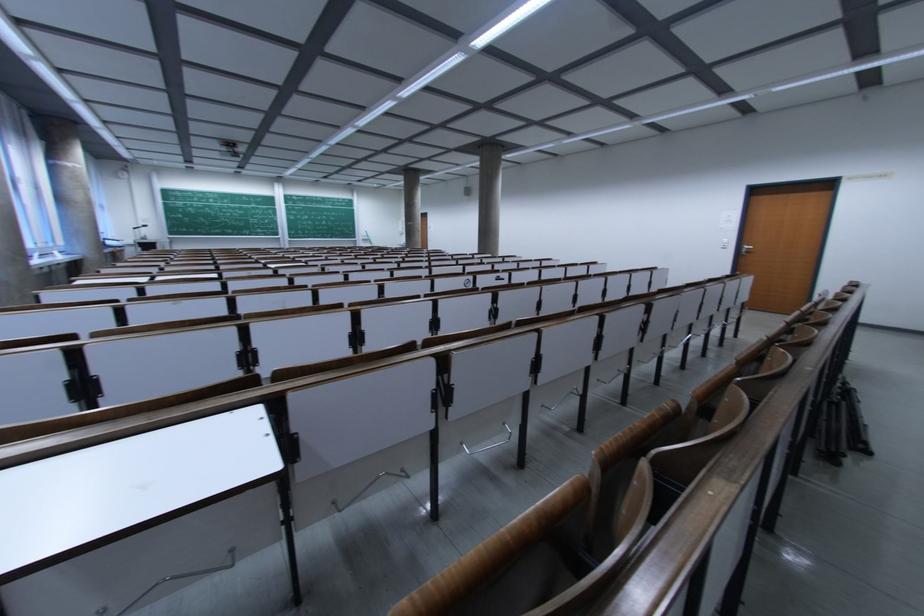
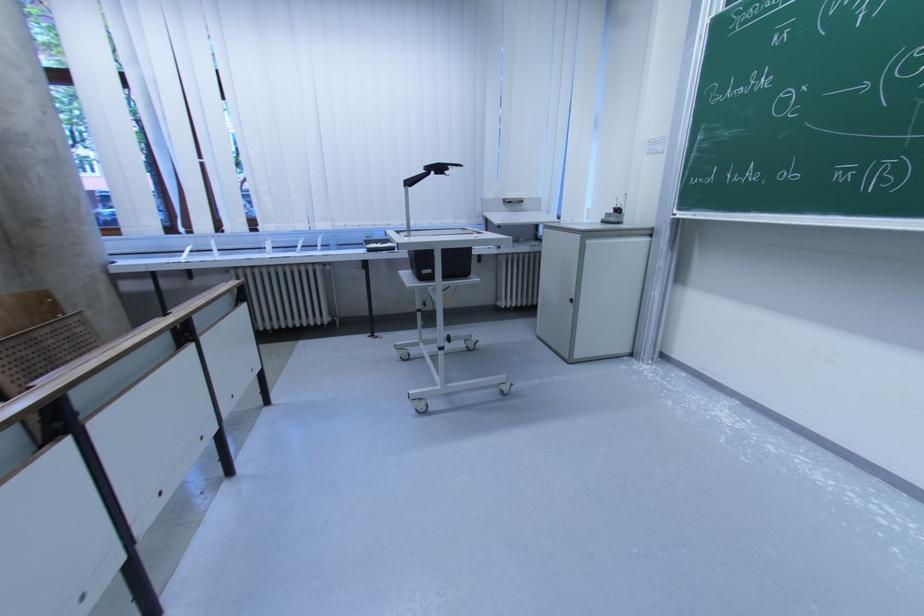
Locate, in the second image, the point that corresponds to point 150,228 in the first image.

(444, 171)